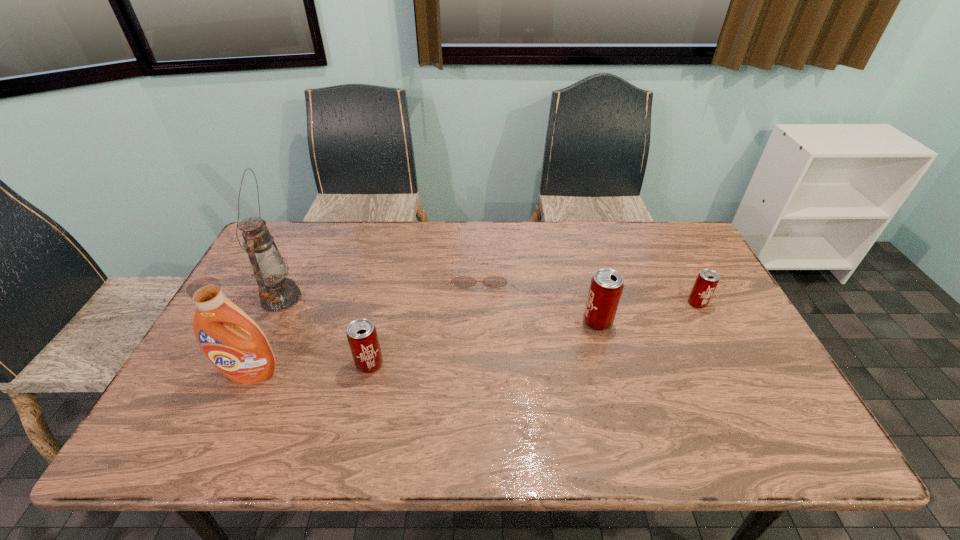
At what (x,y) coordinates should I click in order to perform the action: click on free space for an extra beer_can to achieve even spacing. Please return your answer as a coordinate pair (x, y). The width and height of the screenshot is (960, 540). Looking at the image, I should click on (489, 342).